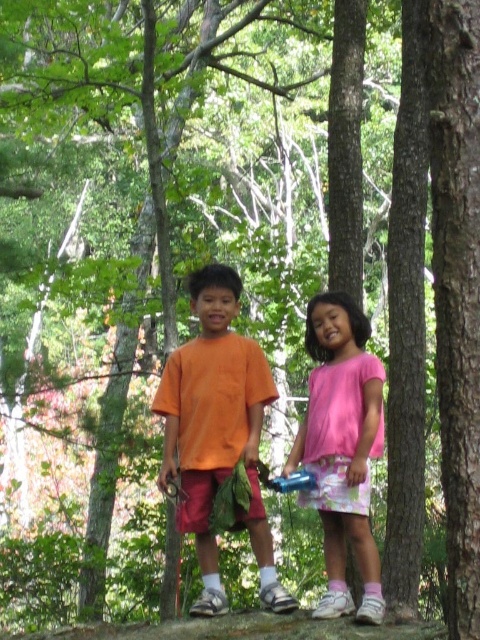
Who is shorter, orange cotton shirt at center or pink fabric dress at center?

pink fabric dress at center

Measure the distance between orange cotton shirt at center and camera.

A distance of 27.29 feet exists between orange cotton shirt at center and camera.

Is point (265, 541) closer to viewer compared to point (360, 474)?

No, (265, 541) is further to viewer.

This screenshot has height=640, width=480. Find the location of `orange cotton shirt at center`. orange cotton shirt at center is located at coordinates (216, 432).